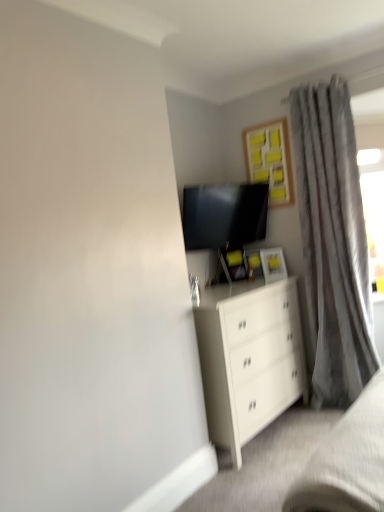
Question: Looking at the image, does gray textured curtain at right seem bigger or smaller compared to matte black tv at upper center?

Choices:
 (A) small
 (B) big

Answer: (B)

Question: Considering the positions of gray textured curtain at right and matte black tv at upper center in the image, is gray textured curtain at right wider or thinner than matte black tv at upper center?

Choices:
 (A) thin
 (B) wide

Answer: (B)

Question: Which object is the closest to the wooden frame with yellow sticky notes at upper center?

Choices:
 (A) gray textured curtain at right
 (B) matte black tv at upper center
 (C) white matte chest of drawers at center
 (D) white matte bed frame at lower right

Answer: (B)

Question: Which of these objects is positioned closest to the matte black tv at upper center?

Choices:
 (A) wooden frame with yellow sticky notes at upper center
 (B) white matte bed frame at lower right
 (C) white matte chest of drawers at center
 (D) gray textured curtain at right

Answer: (A)